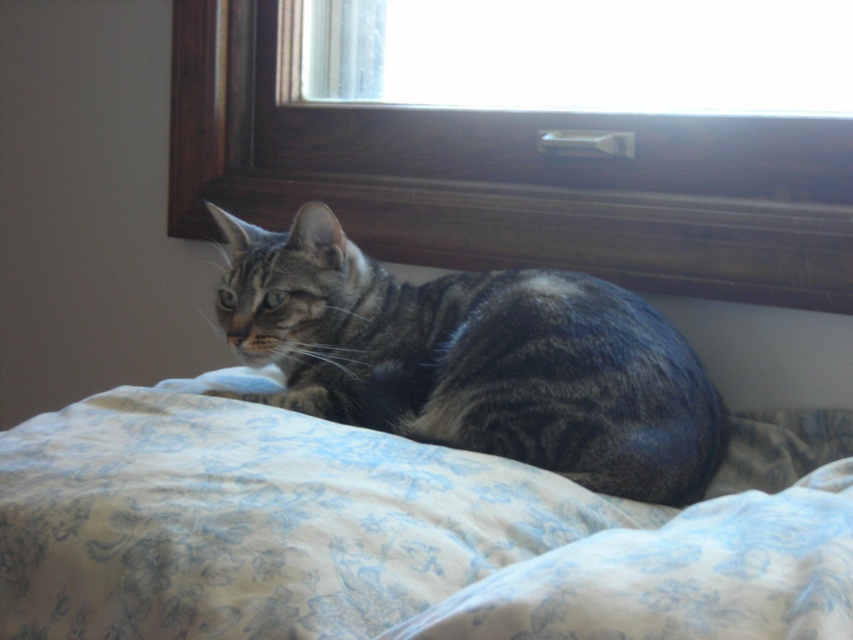
Is floral-patterned fabric at lower center further to camera compared to transparent glass window at upper center?

No, floral-patterned fabric at lower center is in front of transparent glass window at upper center.

Is floral-patterned fabric at lower center wider than transparent glass window at upper center?

Yes, floral-patterned fabric at lower center is wider than transparent glass window at upper center.

Does point (525, 636) lie in front of point (335, 33)?

Yes, point (525, 636) is in front of point (335, 33).

At what (x,y) coordinates should I click in order to perform the action: click on floral-patterned fabric at lower center. Please return your answer as a coordinate pair (x, y). Looking at the image, I should click on (392, 532).

Does floral-patterned fabric at lower center lie behind tabby fur cat at center?

No, floral-patterned fabric at lower center is closer to the viewer.

Does floral-patterned fabric at lower center appear on the left side of tabby fur cat at center?

No, floral-patterned fabric at lower center is not to the left of tabby fur cat at center.

This screenshot has width=853, height=640. Identify the location of floral-patterned fabric at lower center. (392, 532).

Locate an element on the screen. This screenshot has width=853, height=640. floral-patterned fabric at lower center is located at coordinates (392, 532).

Consider the image. Does tabby fur cat at center appear over transparent glass window at upper center?

Incorrect, tabby fur cat at center is not positioned above transparent glass window at upper center.

Which of these two, tabby fur cat at center or transparent glass window at upper center, stands taller?

With more height is tabby fur cat at center.

What are the coordinates of `tabby fur cat at center` in the screenshot? It's located at pos(474,358).

Locate an element on the screen. This screenshot has width=853, height=640. tabby fur cat at center is located at coordinates (474, 358).